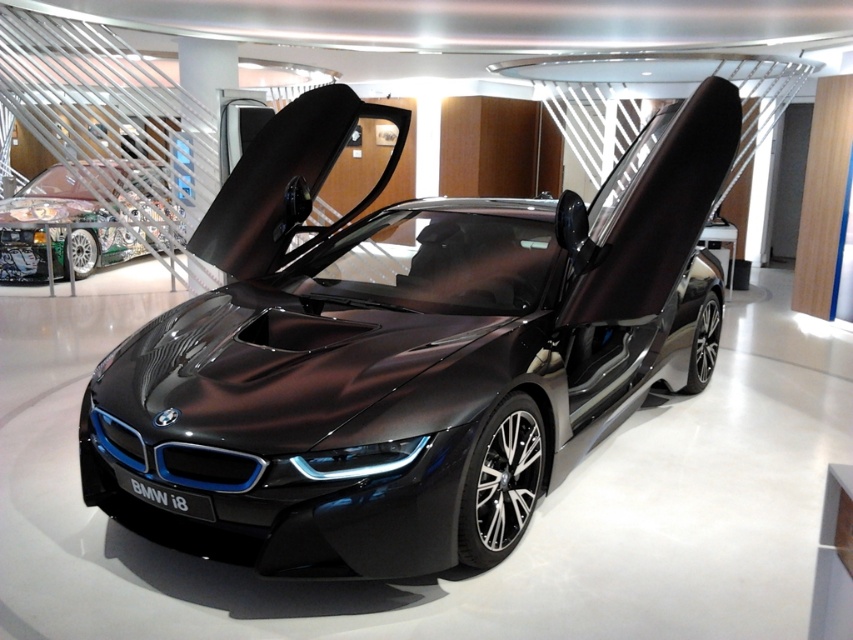
Which is more to the left, glossy metallic car at center or shiny metallic race car at left?

shiny metallic race car at left

At what (x,y) coordinates should I click in order to perform the action: click on glossy metallic car at center. Please return your answer as a coordinate pair (x, y). The image size is (853, 640). Looking at the image, I should click on (405, 355).

The image size is (853, 640). What are the coordinates of `glossy metallic car at center` in the screenshot? It's located at tap(405, 355).